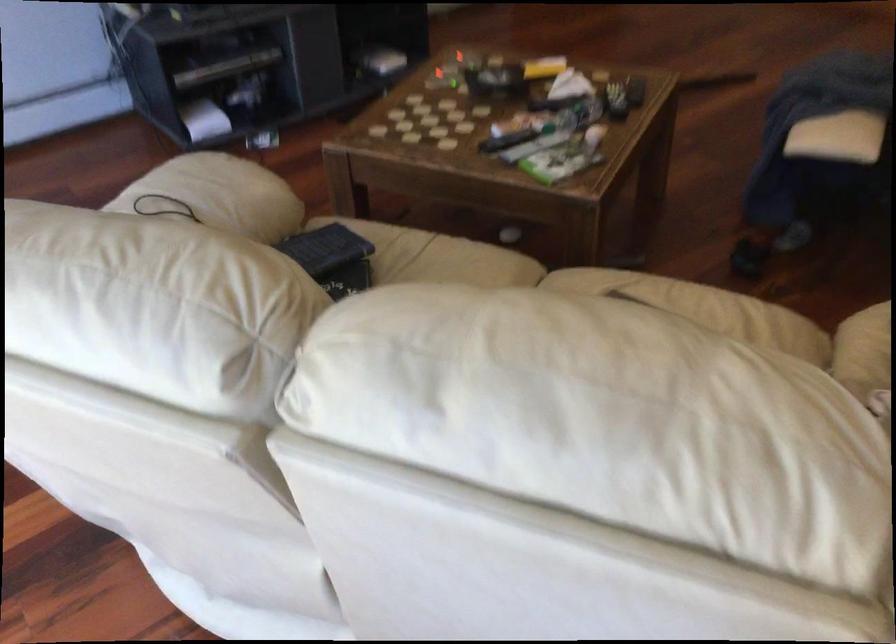
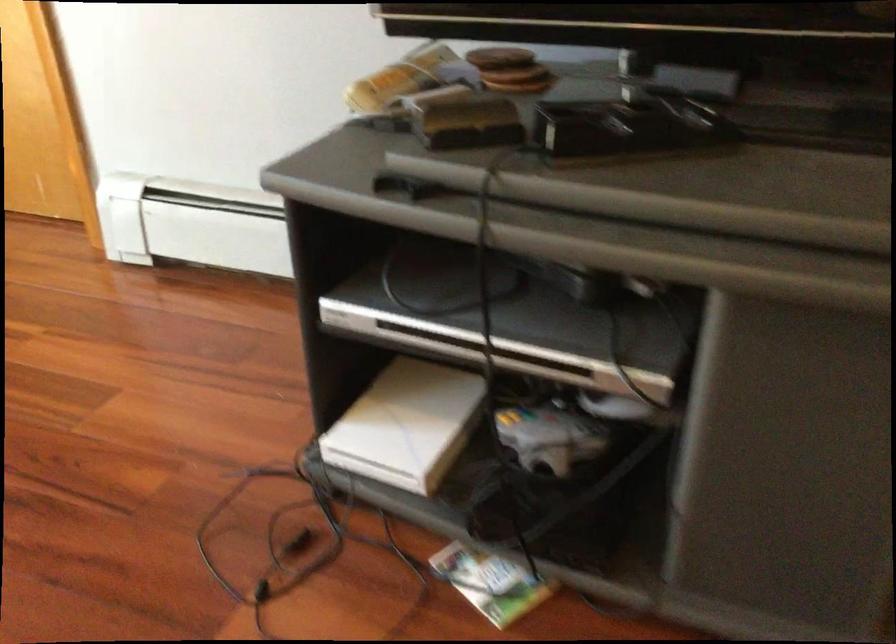
Where in the second image is the point corresponding to (208,111) from the first image?

(407, 424)